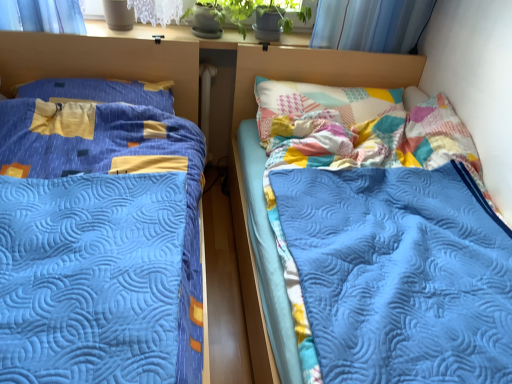
Question: Is blue quilted bed at left, arranged as the 2th bed when viewed from the right, taller or shorter than matte blue pillow at left?

Choices:
 (A) tall
 (B) short

Answer: (A)

Question: Looking at the image, does blue quilted bed at left, arranged as the 2th bed when viewed from the right, seem bigger or smaller compared to matte blue pillow at left?

Choices:
 (A) big
 (B) small

Answer: (A)

Question: Estimate the real-world distances between objects in this image. Which object is farther from the white matte radiator at center?

Choices:
 (A) blue quilted bed at left, arranged as the 2th bed when viewed from the right
 (B) blue quilted bed at right, which is the first bed from right to left
 (C) matte blue pillow at left
 (D) patchwork fabric headboard at upper right

Answer: (B)

Question: Which object is the closest to the blue quilted bed at right, which is the second bed from left to right?

Choices:
 (A) patchwork fabric headboard at upper right
 (B) blue quilted bed at left, which is the 1th bed in left-to-right order
 (C) matte blue pillow at left
 (D) white matte radiator at center

Answer: (A)